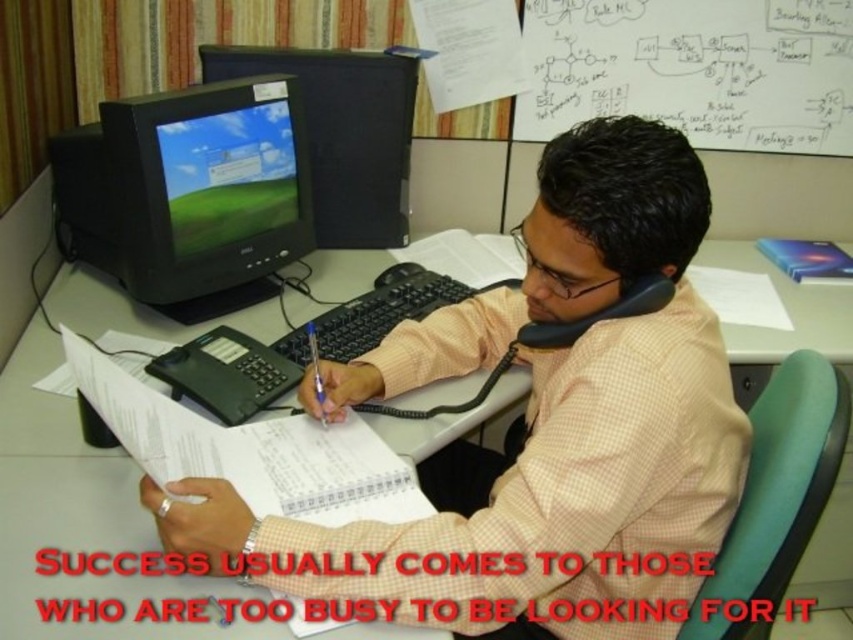
Question: Is matte black monitor at center wider than blue plastic pen at center?

Choices:
 (A) no
 (B) yes

Answer: (B)

Question: Which point is farther to the camera?

Choices:
 (A) matte black monitor at center
 (B) blue plastic pen at center

Answer: (A)

Question: Which point is closer to the camera?

Choices:
 (A) (311, 129)
 (B) (229, 106)
 (C) (315, 356)

Answer: (C)

Question: Is black matte monitor at upper left positioned in front of matte black monitor at center?

Choices:
 (A) no
 (B) yes

Answer: (B)

Question: Can you confirm if pink checkered shirt at center is positioned below white paper at lower center?

Choices:
 (A) yes
 (B) no

Answer: (B)

Question: Which point is farther to the camera?

Choices:
 (A) (746, 632)
 (B) (219, 300)
 (C) (700, 209)
 (D) (322, 403)

Answer: (B)